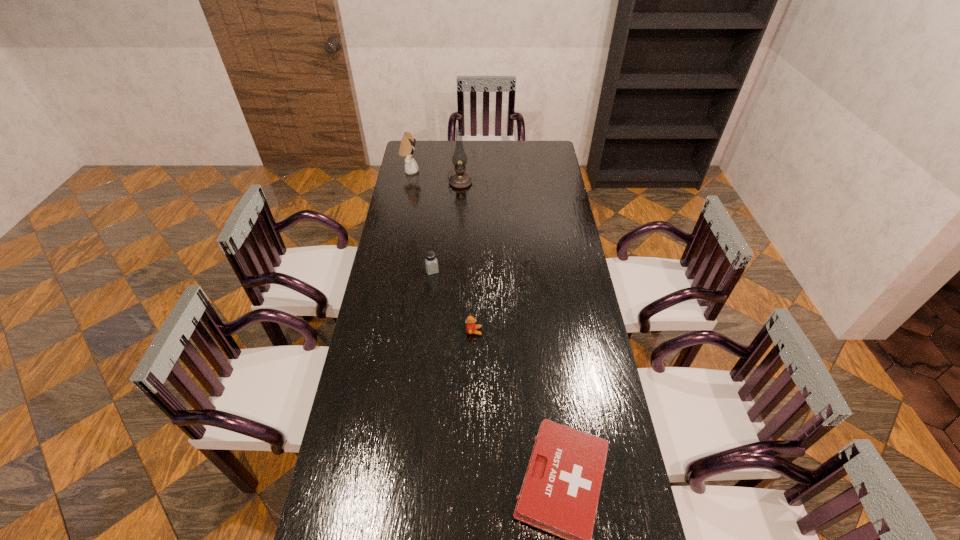
Where is `vacant space that's between the fourth farthest object and the doll`? vacant space that's between the fourth farthest object and the doll is located at coordinates (442, 251).

Where is `free space that is in between the third farthest object and the oil lamp`? The height and width of the screenshot is (540, 960). free space that is in between the third farthest object and the oil lamp is located at coordinates (446, 227).

Identify which object is located as the fourth nearest to the third farthest object. Please provide its 2D coordinates. Your answer should be formatted as a tuple, i.e. [(x, y)], where the tuple contains the x and y coordinates of a point satisfying the conditions above.

[(560, 492)]

At what (x,y) coordinates should I click in order to perform the action: click on object that stands as the fourth closest to the leftmost object. Please return your answer as a coordinate pair (x, y). This screenshot has width=960, height=540. Looking at the image, I should click on (560, 492).

Identify the location of free space that satisfies the following two spatial constraints: 1. on the back side of the second object from left to right; 2. at the front face of the leftmost object. (443, 171).

Identify the location of vacant region that satisfies the following two spatial constraints: 1. on the back side of the saltshaker; 2. at the front face of the leftmost object. click(443, 171).

Identify the location of vacant space that satisfies the following two spatial constraints: 1. at the front face of the second tallest object; 2. on the right side of the fourth object from right to left. pyautogui.click(x=390, y=271).